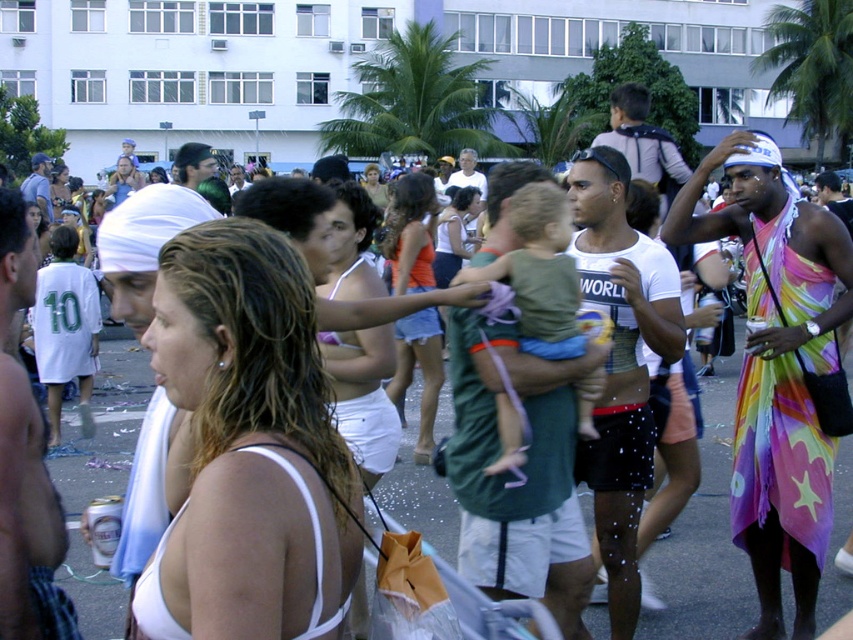
Based on the photo, you are standing at the location of the camera in the scene. There is a rainbow fabric dress at right that you want to photograph. Can you estimate whether you can capture the entire dress in your photo without moving closer, assuming your camera has a standard 50mm lens and you are using a full frame sensor?

The rainbow fabric dress at right is 4.89 meters away from the camera. With a standard 50mm lens and full frame sensor, the minimum focus distance for sharpness is typically around 0.3 meters, so you can easily capture the dress clearly. However, to ensure the entire dress fits within the frame, you might need to adjust your position or use a wider lens. The distance itself doesn not prevent capturing the dress, but framing could require adjustments.

You are standing in the crowd at the festive event. You notice two points in the scene, one at coordinates point [554,202] and the other at point [407,352]. Which point is closer to your vantage point?

Point [554,202] is closer to the camera than point [407,352], so the first point is closer to your vantage point.

You are planning to buy a swimsuit for a beach day and are comparing the white fabric bikini top at center and the rainbow fabric dress at right. Based on the image, which one is narrower in width?

The white fabric bikini top at center is narrower in width than the rainbow fabric dress at right.